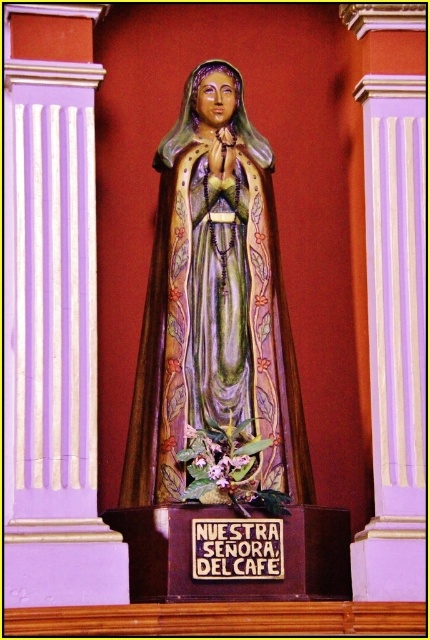
You are an art conservator assessing the statue and plaque. Given their sizes, which object would require more space for storage? Please refer to the polychrome wood statue at center and the wooden plaque at center in your answer.

The polychrome wood statue at center requires more storage space because it has a larger size compared to the wooden plaque at center.

You are an art conservator examining the statue and its pedestal. You need to clean both the polychrome wood statue at center and the wooden plaque at center. Which one should you start with if you want to work from the bottom up?

You should start with the wooden plaque at center because it is located below the polychrome wood statue at center.